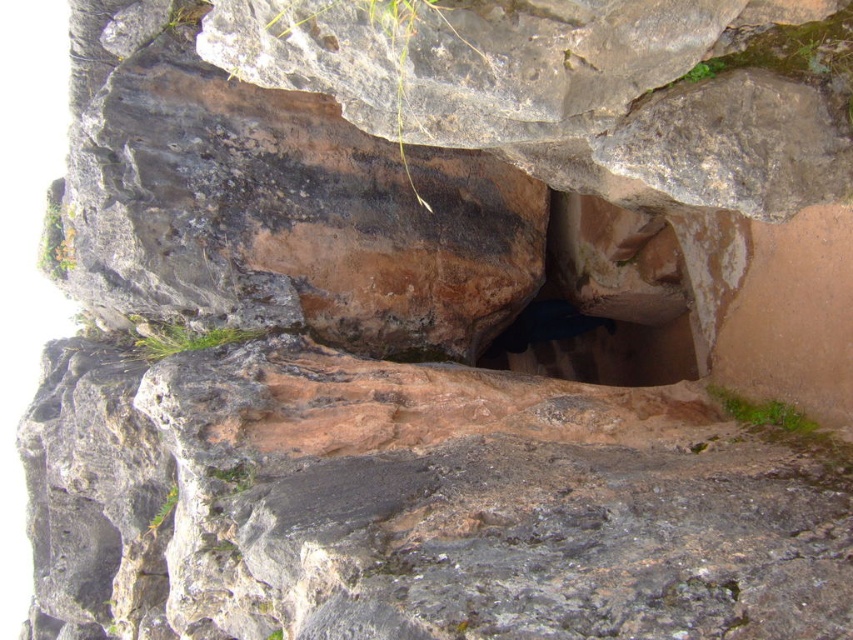
You are standing at the entrance of the cave and see two points marked on the rock formation. Which point, point (650, 333) or point (537, 330), is closer to you?

Point (650, 333) is in front of point (537, 330), so it is closer to you.

You are an explorer standing at the entrance of the cave and see the brown stone staircase at center and the dark brown stone hole at center. Which object is closer to you?

The brown stone staircase at center is closer to you because it is in front of the dark brown stone hole at center.